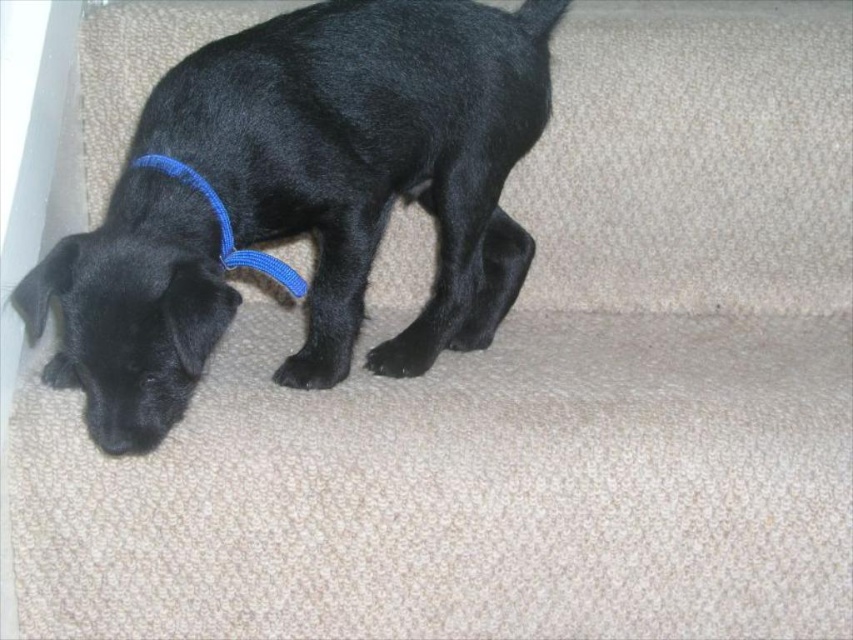
You are standing at the bottom of the staircase in the image and want to place a small toy at the point closer to you. Which point should you choose between point [183,397] and point [257,269]?

Point [183,397] is closer to the camera than point [257,269], so you should choose point [183,397] to place the small toy closer to you.

You are a dog trainer observing the black fur dog at lower left and the blue fabric neckband at left. Based on their positions, which object is higher up in the image?

The black fur dog at lower left is higher up than the blue fabric neckband at left because the black fur dog at lower left is above blue fabric neckband at left.

You are a dog trainer observing a black fur dog at lower left and a blue fabric neckband at left. Which object takes up more space in the image?

The black fur dog at lower left takes up more space in the image because it is larger in size than the blue fabric neckband at left.